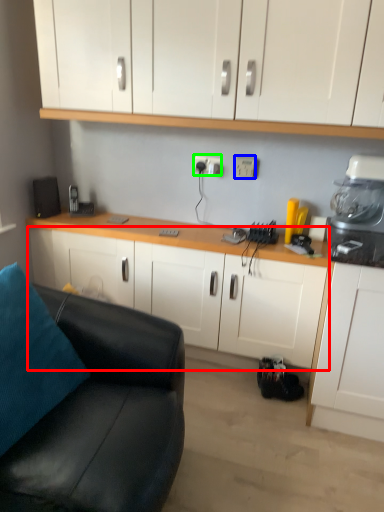
Question: Estimate the real-world distances between objects in this image. Which object is farther from cabinetry (highlighted by a red box), electric outlet (highlighted by a blue box) or electric outlet (highlighted by a green box)?

Choices:
 (A) electric outlet
 (B) electric outlet

Answer: (A)